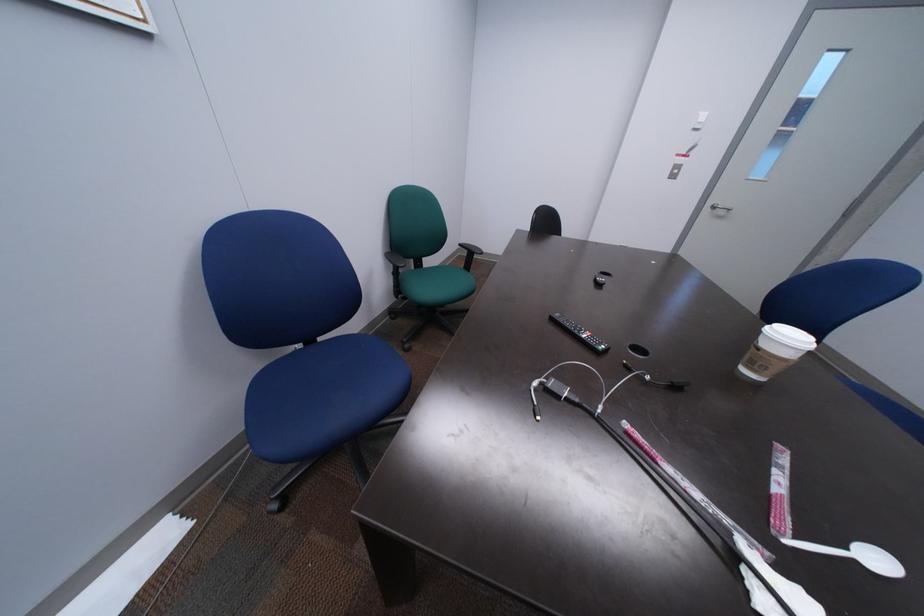
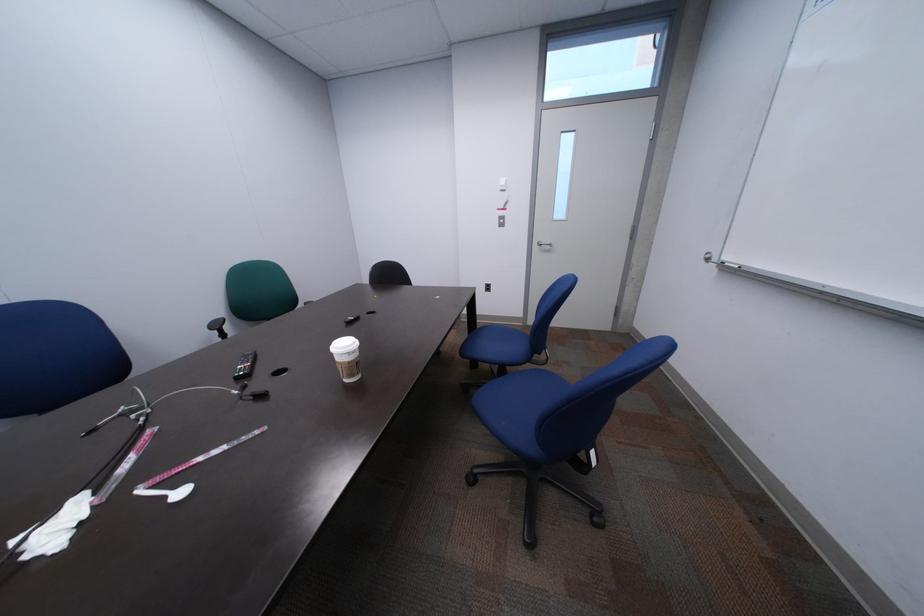
Question: What movement of the cameraman would produce the second image?

Choices:
 (A) Left
 (B) Right
 (C) Forward
 (D) Backward

Answer: (B)